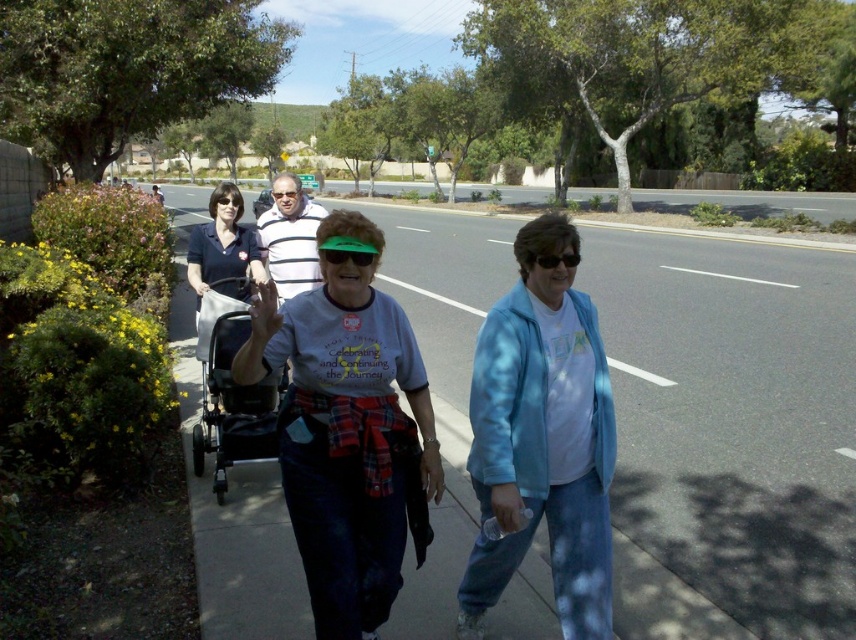
Who is taller, light blue t-shirt at center or matte blue shirt at upper left?

light blue t-shirt at center

In the scene shown: Can you confirm if light blue t-shirt at center is taller than matte blue shirt at upper left?

Correct, light blue t-shirt at center is much taller as matte blue shirt at upper left.

Who is more forward, (x=364, y=566) or (x=201, y=278)?

Point (x=364, y=566)

Where is `light blue t-shirt at center`? The width and height of the screenshot is (856, 640). light blue t-shirt at center is located at coordinates (345, 429).

Is light blue t-shirt at center to the left of black plastic sunglasses at center from the viewer's perspective?

Correct, you'll find light blue t-shirt at center to the left of black plastic sunglasses at center.

What do you see at coordinates (345, 429) in the screenshot? I see `light blue t-shirt at center` at bounding box center [345, 429].

Find the location of a particular element. light blue t-shirt at center is located at coordinates (345, 429).

Does point (604, 420) come closer to viewer compared to point (244, 252)?

Yes, point (604, 420) is closer to viewer.

Does blue fabric jacket at center have a lesser height compared to matte blue shirt at upper left?

In fact, blue fabric jacket at center may be taller than matte blue shirt at upper left.

Who is more forward, (x=602, y=616) or (x=236, y=228)?

Point (x=602, y=616) is in front.

At what (x,y) coordinates should I click in order to perform the action: click on blue fabric jacket at center. Please return your answer as a coordinate pair (x, y). The width and height of the screenshot is (856, 640). Looking at the image, I should click on (542, 440).